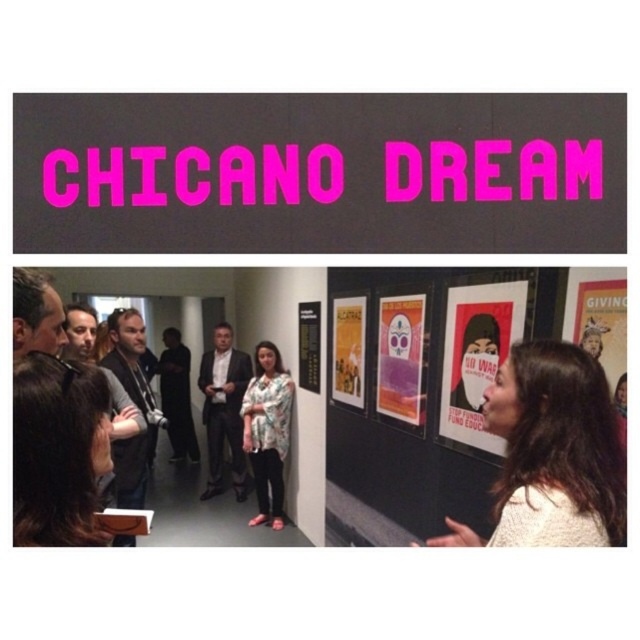
Looking at this image, you are an art curator arranging a new exhibition. You notice the matte black poster at center and the matte purple poster at center in the gallery. Which poster is located to the right of the other?

The matte black poster at center is positioned on the right side of the matte purple poster at center.

You are an art curator planning to install a new neon sign in the gallery. The sign will be placed at point (476, 355). What color should the neon sign be to match the existing decor?

The point (476, 355) marks a matte black poster at center, so the neon sign should be black to match the existing decor.